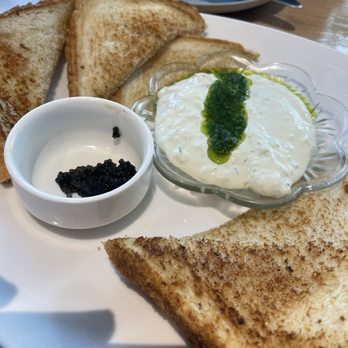
The height and width of the screenshot is (348, 348). Identify the location of bottom of white bowl. (68, 155).